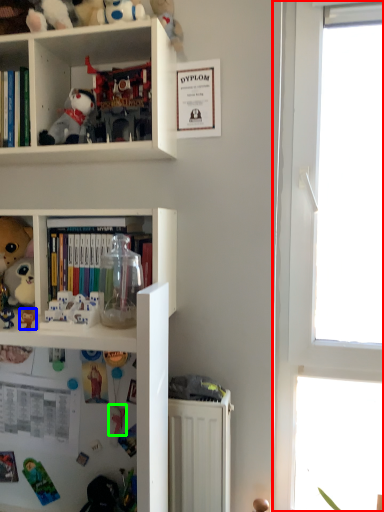
Question: Based on their relative distances, which object is nearer to window (highlighted by a red box)? Choose from toy (highlighted by a blue box) and toy (highlighted by a green box).

Choices:
 (A) toy
 (B) toy

Answer: (B)